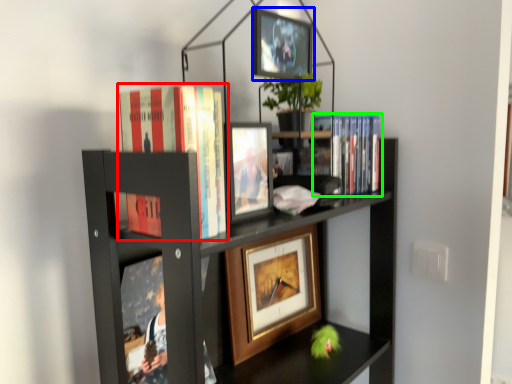
Question: Based on their relative distances, which object is nearer to book (highlighted by a red box)? Choose from picture frame (highlighted by a blue box) and book (highlighted by a green box).

Choices:
 (A) picture frame
 (B) book

Answer: (A)